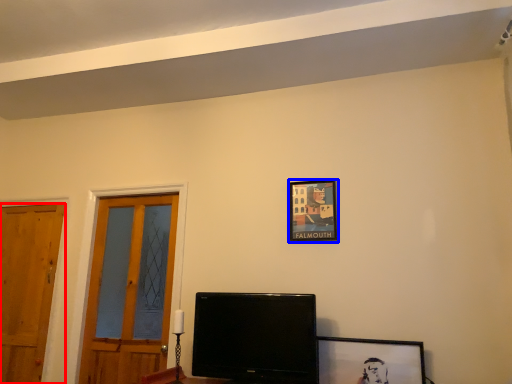
Question: Which of the following is the closest to the observer, door (highlighted by a red box) or picture frame (highlighted by a blue box)?

Choices:
 (A) door
 (B) picture frame

Answer: (B)